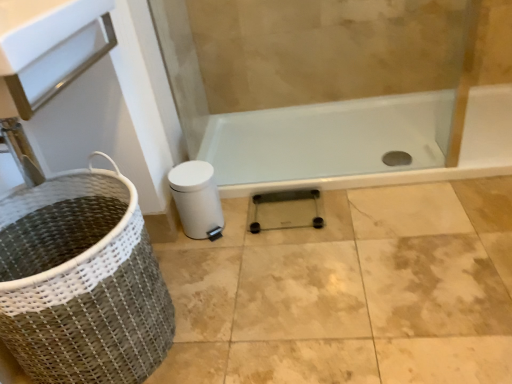
Question: Is transparent glass scale at center wider than woven fabric basket at lower left?

Choices:
 (A) no
 (B) yes

Answer: (A)

Question: Can you confirm if transparent glass scale at center is positioned to the right of woven fabric basket at lower left?

Choices:
 (A) yes
 (B) no

Answer: (A)

Question: Is transparent glass scale at center completely or partially outside of woven fabric basket at lower left?

Choices:
 (A) no
 (B) yes

Answer: (B)

Question: Is transparent glass scale at center in front of woven fabric basket at lower left?

Choices:
 (A) no
 (B) yes

Answer: (A)

Question: From the image's perspective, would you say transparent glass scale at center is shown under woven fabric basket at lower left?

Choices:
 (A) yes
 (B) no

Answer: (B)

Question: Is transparent glass scale at center looking in the opposite direction of woven fabric basket at lower left?

Choices:
 (A) no
 (B) yes

Answer: (A)

Question: Is woven fabric basket at lower left taller than transparent glass scale at center?

Choices:
 (A) no
 (B) yes

Answer: (B)

Question: Is woven fabric basket at lower left not near transparent glass scale at center?

Choices:
 (A) no
 (B) yes

Answer: (A)

Question: Does woven fabric basket at lower left contain transparent glass scale at center?

Choices:
 (A) no
 (B) yes

Answer: (A)

Question: Is the surface of woven fabric basket at lower left in direct contact with transparent glass scale at center?

Choices:
 (A) no
 (B) yes

Answer: (A)

Question: Can you confirm if woven fabric basket at lower left is bigger than transparent glass scale at center?

Choices:
 (A) yes
 (B) no

Answer: (A)

Question: From a real-world perspective, is woven fabric basket at lower left located higher than transparent glass scale at center?

Choices:
 (A) no
 (B) yes

Answer: (B)

Question: Based on their sizes in the image, would you say woven fabric basket at lower left is bigger or smaller than transparent glass scale at center?

Choices:
 (A) big
 (B) small

Answer: (A)